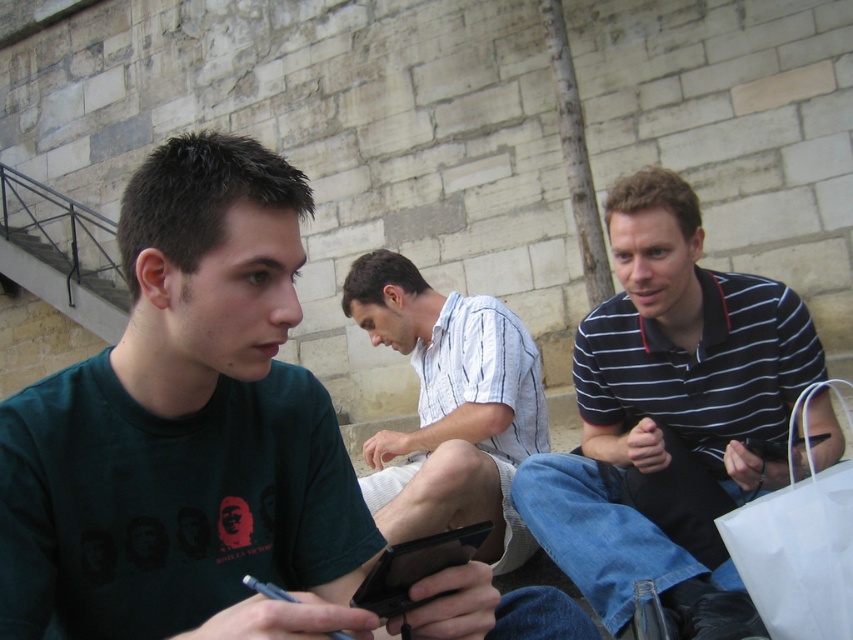
Question: Which point is farther to the camera?

Choices:
 (A) dark green t-shirt at left
 (B) striped cotton shirt at right
 (C) white paper bag at lower right
 (D) white striped shirt at center

Answer: (D)

Question: Does dark green t-shirt at left have a smaller size compared to striped cotton shirt at right?

Choices:
 (A) no
 (B) yes

Answer: (B)

Question: From the image, what is the correct spatial relationship of striped cotton shirt at right in relation to white striped shirt at center?

Choices:
 (A) above
 (B) below

Answer: (A)

Question: Is white striped shirt at center wider than black plastic phone at center?

Choices:
 (A) no
 (B) yes

Answer: (B)

Question: Among these objects, which one is farthest from the camera?

Choices:
 (A) black plastic phone at center
 (B) dark green t-shirt at left
 (C) white paper bag at lower right
 (D) striped cotton shirt at right

Answer: (D)

Question: Among these points, which one is farthest from the camera?

Choices:
 (A) (640, 292)
 (B) (518, 524)
 (C) (473, 548)

Answer: (B)